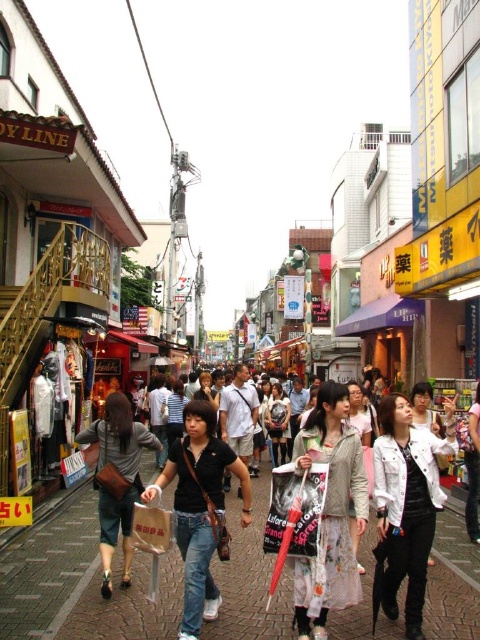
Is the position of white printed dress at center more distant than that of dark gray leather bag at lower left?

That is False.

In the scene shown: How distant is white printed dress at center from dark gray leather bag at lower left?

A distance of 15.61 meters exists between white printed dress at center and dark gray leather bag at lower left.

The image size is (480, 640). Describe the element at coordinates (331, 513) in the screenshot. I see `white printed dress at center` at that location.

Image resolution: width=480 pixels, height=640 pixels. Identify the location of white printed dress at center. (331, 513).

Does white matte jacket at lower right appear on the right side of dark gray leather bag at lower left?

Indeed, white matte jacket at lower right is positioned on the right side of dark gray leather bag at lower left.

Does white matte jacket at lower right appear under dark gray leather bag at lower left?

No.

In the scene shown: Measure the distance between point (x=407, y=520) and camera.

Point (x=407, y=520) is 45.03 meters from camera.

This screenshot has width=480, height=640. In order to click on white matte jacket at lower right in this screenshot , I will do `click(407, 504)`.

Based on the photo, is white matte jacket at lower right wider than floral fabric dress at center?

Indeed, white matte jacket at lower right has a greater width compared to floral fabric dress at center.

Which is more to the right, white matte jacket at lower right or floral fabric dress at center?

Positioned to the right is floral fabric dress at center.

What do you see at coordinates (407, 504) in the screenshot?
I see `white matte jacket at lower right` at bounding box center [407, 504].

This screenshot has width=480, height=640. I want to click on white matte jacket at lower right, so click(x=407, y=504).